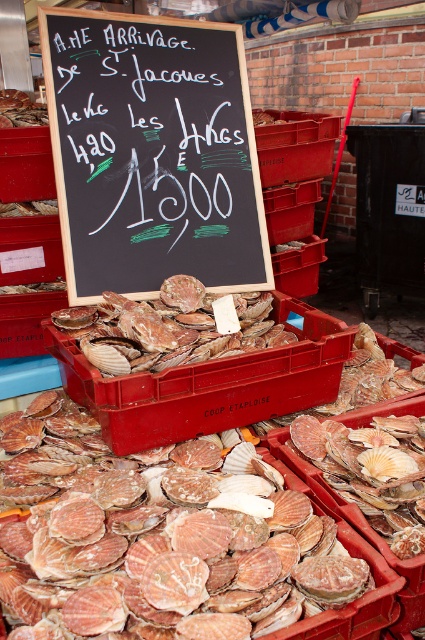
Question: Which point is closer to the camera?

Choices:
 (A) shiny brown scallop at center
 (B) black chalkboard at upper center

Answer: (A)

Question: Is the position of black chalkboard at upper center less distant than that of pinkish-brown shell at center?

Choices:
 (A) yes
 (B) no

Answer: (B)

Question: Based on their relative distances, which object is nearer to the black chalkboard at upper center?

Choices:
 (A) shiny brown scallop at center
 (B) pinkish-brown shell at center

Answer: (A)

Question: Can you confirm if pinkish-brown shell at center is positioned above shiny brown scallop at center?

Choices:
 (A) yes
 (B) no

Answer: (B)

Question: Where is black chalkboard at upper center located in relation to pinkish-brown shell at center in the image?

Choices:
 (A) below
 (B) above

Answer: (B)

Question: Estimate the real-world distances between objects in this image. Which object is closer to the black chalkboard at upper center?

Choices:
 (A) pinkish-brown shell at center
 (B) shiny brown scallop at center

Answer: (B)